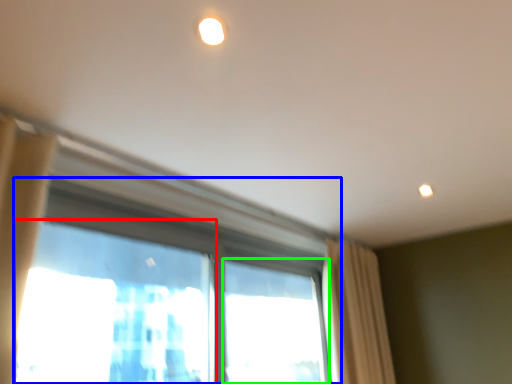
Question: Which object is positioned farthest from window screen (highlighted by a red box)? Select from window (highlighted by a blue box) and window (highlighted by a green box).

Choices:
 (A) window
 (B) window

Answer: (A)